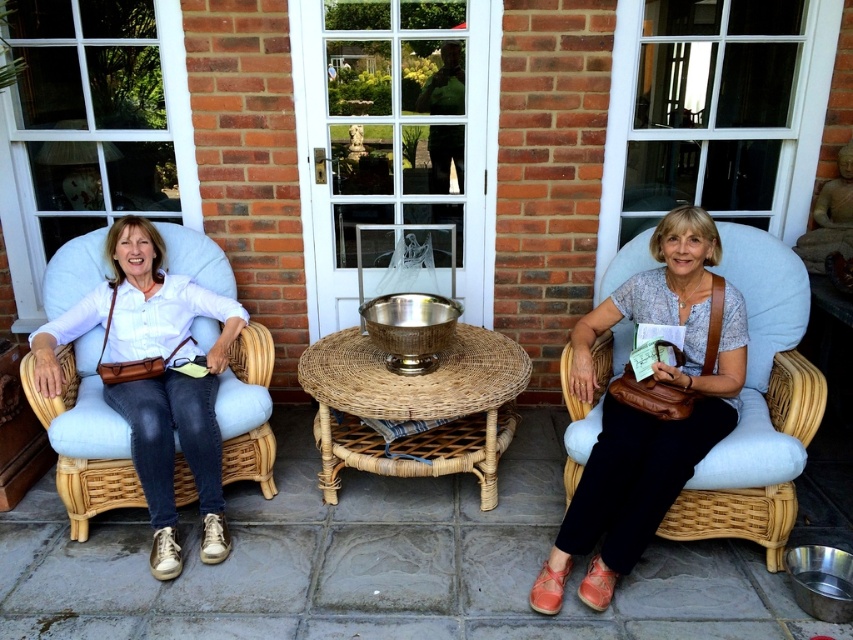
Question: Is matte leather armchair at right positioned at the back of matte white blouse at left?

Choices:
 (A) yes
 (B) no

Answer: (B)

Question: Among these points, which one is farthest from the camera?

Choices:
 (A) (171, 381)
 (B) (338, 372)

Answer: (B)

Question: Does matte white blouse at left have a lesser width compared to woven rattan table at center?

Choices:
 (A) no
 (B) yes

Answer: (B)

Question: Estimate the real-world distances between objects in this image. Which object is farther from the matte leather armchair at right?

Choices:
 (A) woven rattan table at center
 (B) matte white blouse at left

Answer: (B)

Question: Can you confirm if matte leather armchair at right is positioned to the left of matte white blouse at left?

Choices:
 (A) no
 (B) yes

Answer: (A)

Question: Which of the following is the closest to the observer?

Choices:
 (A) (193, 442)
 (B) (729, 440)
 (C) (366, 429)

Answer: (B)